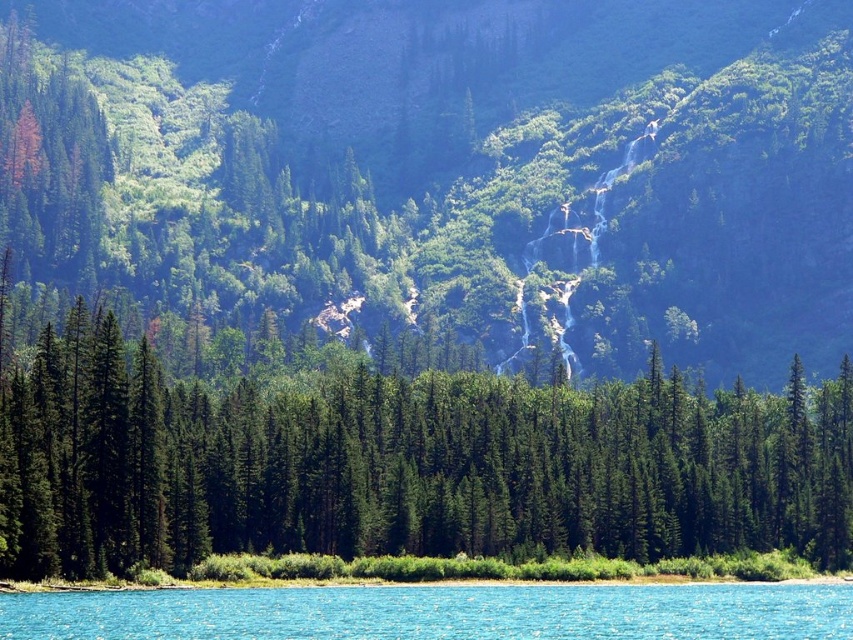
Question: Considering the real-world distances, which object is closest to the green textured hillside at center?

Choices:
 (A) green matte tree at center
 (B) clear blue water at lower center

Answer: (A)

Question: Can you confirm if green textured hillside at center is positioned above green matte tree at center?

Choices:
 (A) yes
 (B) no

Answer: (A)

Question: Does green matte tree at center appear under clear blue water at lower center?

Choices:
 (A) no
 (B) yes

Answer: (A)

Question: Considering the real-world distances, which object is closest to the green matte tree at center?

Choices:
 (A) green textured hillside at center
 (B) clear blue water at lower center

Answer: (B)

Question: Which object appears farthest from the camera in this image?

Choices:
 (A) green textured hillside at center
 (B) clear blue water at lower center
 (C) green matte tree at center

Answer: (A)

Question: Does green textured hillside at center have a lesser width compared to green matte tree at center?

Choices:
 (A) no
 (B) yes

Answer: (A)